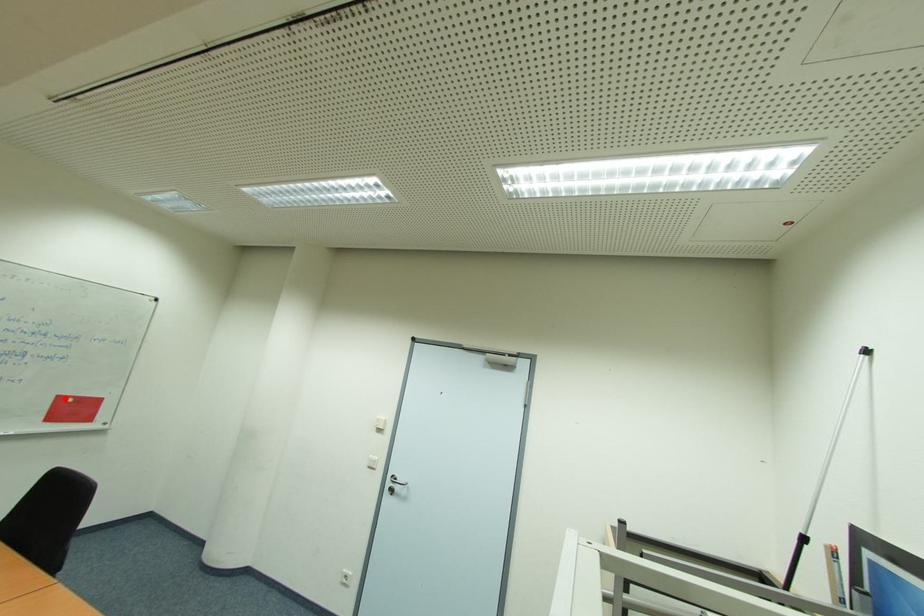
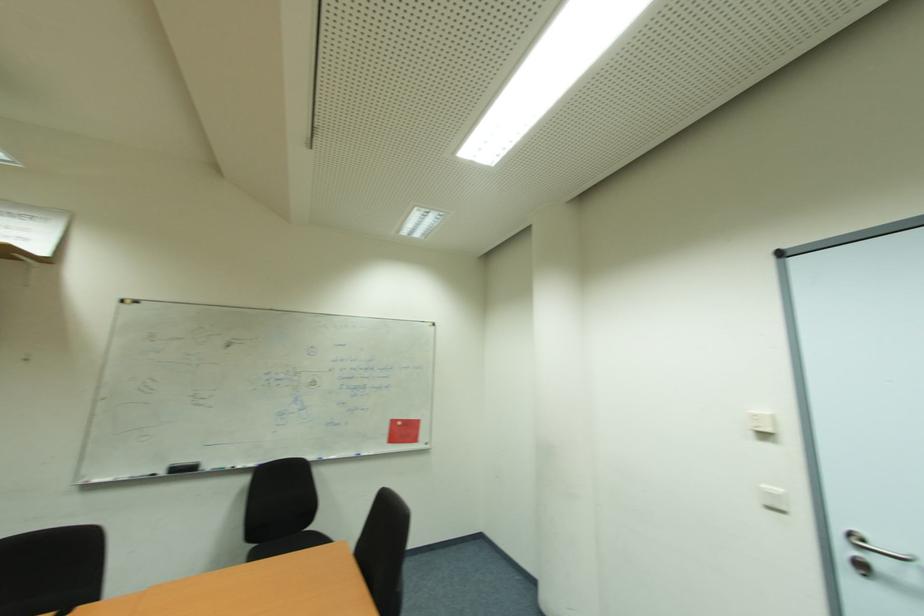
Question: I am providing you with two images of the same scene from different viewpoints. In image1, a red point is highlighted. Considering the same 3D point in image2, which of the following is correct?

Choices:
 (A) It is closer
 (B) It is farther

Answer: (B)